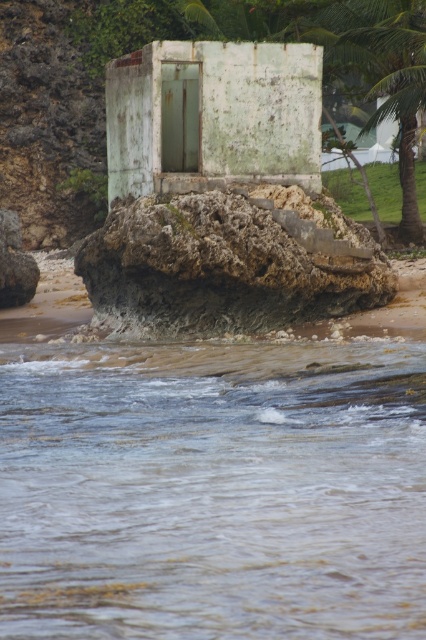
You are standing at the point labeled point (x=377, y=120) and want to walk towards the structure. Which direction should you move relative to point (x=316, y=296)?

To reach the structure from point (x=377, y=120), you should move towards point (x=316, y=296) since it is in front of your current position.

You are standing at the beach and want to take a photo of the rusty concrete rock at center and the green leafy palm tree at upper right. Which object should you zoom in on first to ensure both are in frame?

You should zoom in on the rusty concrete rock at center first because it is shorter than the green leafy palm tree at upper right, so adjusting focus on the shorter object ensures both are captured in the frame.